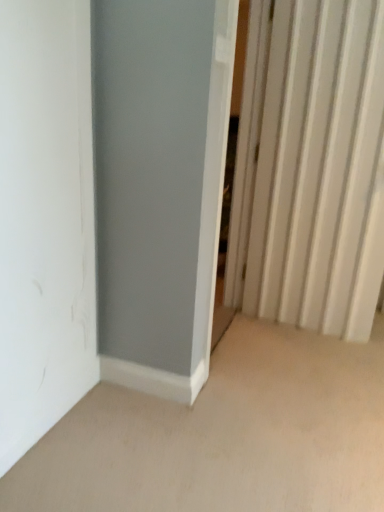
Identify the location of white plastic radiator at right. (321, 170).

Measure the distance between point (325,191) and camera.

A distance of 2.32 meters exists between point (325,191) and camera.

In order to face white plastic radiator at right, should I rotate leftwards or rightwards?

To face it directly, rotate right by 17.680 degrees.

The width and height of the screenshot is (384, 512). What do you see at coordinates (321, 170) in the screenshot?
I see `white plastic radiator at right` at bounding box center [321, 170].

The image size is (384, 512). I want to click on white matte door at left, so click(x=45, y=219).

What do you see at coordinates (45, 219) in the screenshot? I see `white matte door at left` at bounding box center [45, 219].

I want to click on white plastic radiator at right, so click(321, 170).

Is white plastic radiator at right to the right of white matte door at left from the viewer's perspective?

Correct, you'll find white plastic radiator at right to the right of white matte door at left.

Between white plastic radiator at right and white matte door at left, which one is positioned in front?

Positioned in front is white matte door at left.

Is point (277, 229) positioned behind point (51, 376)?

Yes, it is behind point (51, 376).

From the image's perspective, is white plastic radiator at right positioned above or below white matte door at left?

white plastic radiator at right is situated higher than white matte door at left in the image.

From a real-world perspective, is white plastic radiator at right physically above white matte door at left?

Correct, in the physical world, white plastic radiator at right is higher than white matte door at left.

Which object is thinner, white plastic radiator at right or white matte door at left?

white matte door at left is thinner.

Is white plastic radiator at right taller than white matte door at left?

Yes.

Considering the relative sizes of white plastic radiator at right and white matte door at left in the image provided, is white plastic radiator at right bigger than white matte door at left?

Correct, white plastic radiator at right is larger in size than white matte door at left.

Is white matte door at left located within white plastic radiator at right?

That's incorrect, white matte door at left is not inside white plastic radiator at right.

Is white plastic radiator at right beside white matte door at left?

white plastic radiator at right is not next to white matte door at left, and they're not touching.

Is white plastic radiator at right oriented towards white matte door at left?

Yes, white plastic radiator at right is aimed at white matte door at left.

How much distance is there between white plastic radiator at right and white matte door at left?

white plastic radiator at right is 4.26 feet away from white matte door at left.

Where is `door that is below the white plastic radiator at right (from the image's perspective)`? door that is below the white plastic radiator at right (from the image's perspective) is located at coordinates (45, 219).

Which object is positioned more to the left, white matte door at left or white plastic radiator at right?

From the viewer's perspective, white matte door at left appears more on the left side.

In the scene shown: Considering their positions, is white matte door at left located in front of or behind white plastic radiator at right?

Visually, white matte door at left is located in front of white plastic radiator at right.

Between point (47, 399) and point (358, 111), which one is positioned behind?

The point (358, 111) is farther from the camera.

From the image's perspective, is white matte door at left on white plastic radiator at right?

No, from the image's perspective, white matte door at left is not on top of white plastic radiator at right.

From a real-world perspective, is white matte door at left physically above white plastic radiator at right?

No, from a real-world perspective, white matte door at left is not above white plastic radiator at right.

Does white matte door at left have a greater width compared to white plastic radiator at right?

Incorrect, the width of white matte door at left does not surpass that of white plastic radiator at right.

Based on the photo, in terms of height, does white matte door at left look taller or shorter compared to white plastic radiator at right?

In the image, white matte door at left appears to be shorter than white plastic radiator at right.

Between white matte door at left and white plastic radiator at right, which one has larger size?

Bigger between the two is white plastic radiator at right.

Is white plastic radiator at right a part of white matte door at left?

No, white matte door at left does not contain white plastic radiator at right.

Looking at this image, are white matte door at left and white plastic radiator at right making contact?

No, white matte door at left is not making contact with white plastic radiator at right.

Does white matte door at left turn towards white plastic radiator at right?

No, white matte door at left is not facing towards white plastic radiator at right.

How many degrees apart are the facing directions of white matte door at left and white plastic radiator at right?

They differ by 98.5 degrees in their facing directions.

I want to click on door in front of the white plastic radiator at right, so click(45, 219).

I want to click on door in front of the white plastic radiator at right, so click(x=45, y=219).

The image size is (384, 512). I want to click on door located on the left of white plastic radiator at right, so click(x=45, y=219).